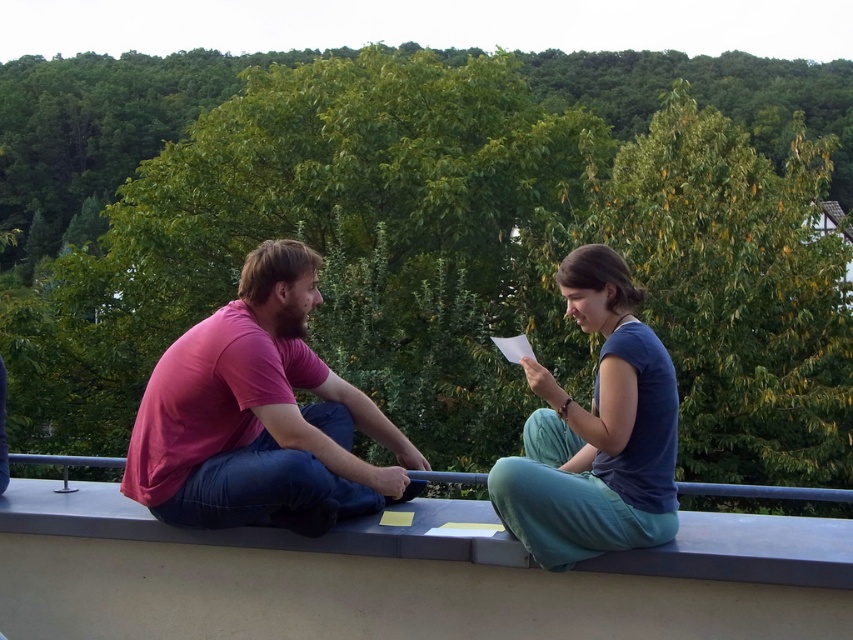
Based on the photo, can you confirm if smooth concrete ledge at center is wider than blue cotton shirt at center?

Indeed, smooth concrete ledge at center has a greater width compared to blue cotton shirt at center.

Is smooth concrete ledge at center shorter than blue cotton shirt at center?

Correct, smooth concrete ledge at center is not as tall as blue cotton shirt at center.

Describe the element at coordinates (505, 561) in the screenshot. I see `smooth concrete ledge at center` at that location.

This screenshot has height=640, width=853. What are the coordinates of `smooth concrete ledge at center` in the screenshot? It's located at (505, 561).

Image resolution: width=853 pixels, height=640 pixels. In order to click on smooth concrete ledge at center in this screenshot , I will do `click(505, 561)`.

Is smooth concrete ledge at center shorter than pink cotton shirt at left?

Indeed, smooth concrete ledge at center has a lesser height compared to pink cotton shirt at left.

Who is more forward, (486, 550) or (228, 476)?

Point (486, 550)

The image size is (853, 640). I want to click on smooth concrete ledge at center, so click(x=505, y=561).

Can you confirm if pink cotton shirt at center is smaller than pink cotton shirt at left?

Indeed, pink cotton shirt at center has a smaller size compared to pink cotton shirt at left.

Does pink cotton shirt at center have a greater width compared to pink cotton shirt at left?

In fact, pink cotton shirt at center might be narrower than pink cotton shirt at left.

The height and width of the screenshot is (640, 853). I want to click on pink cotton shirt at center, so click(x=262, y=426).